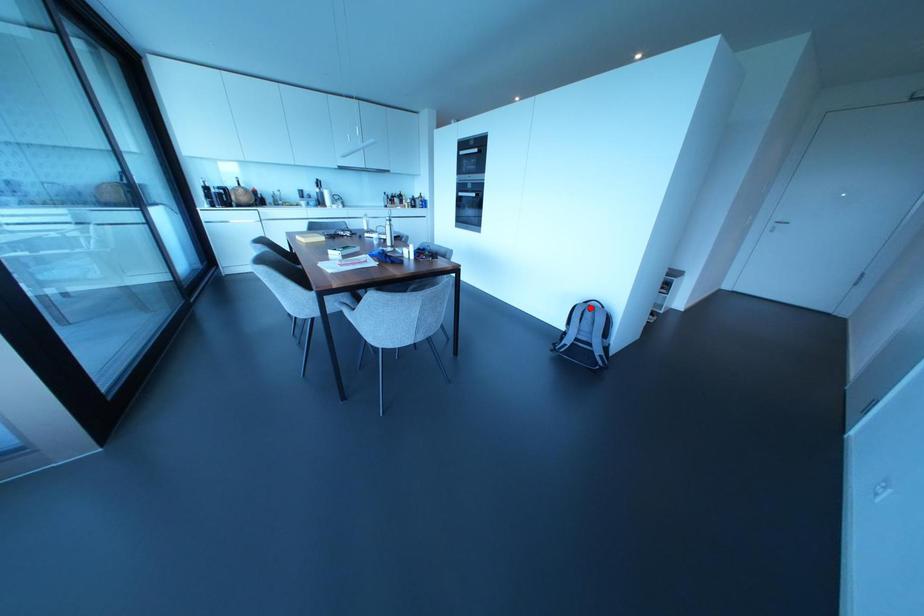
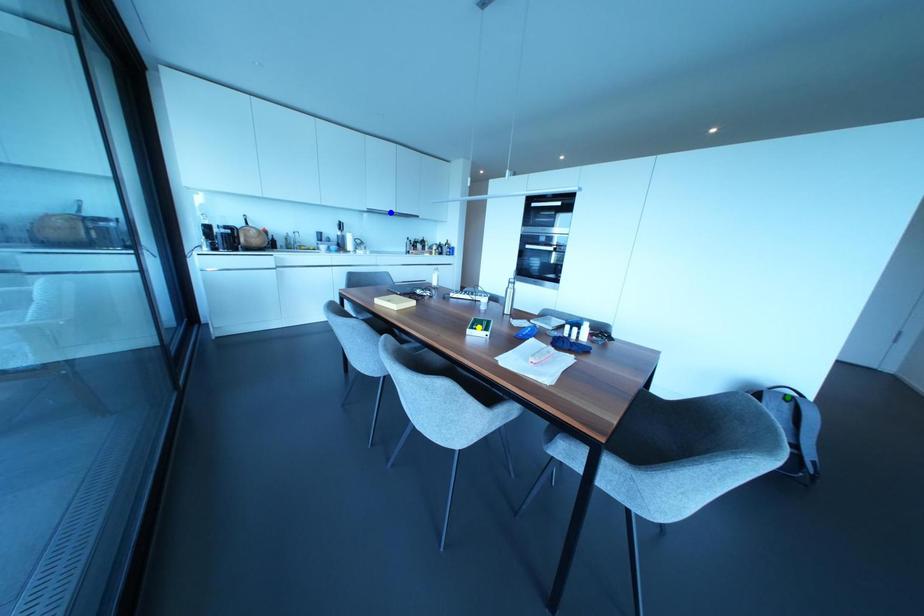
Question: I am providing you with two images of the same scene from different viewpoints. A red point is marked on the first image. You are given multiple points on the second image. Which mark in image 2 goes with the point in image 1?

Choices:
 (A) blue point
 (B) green point
 (C) yellow point

Answer: (B)